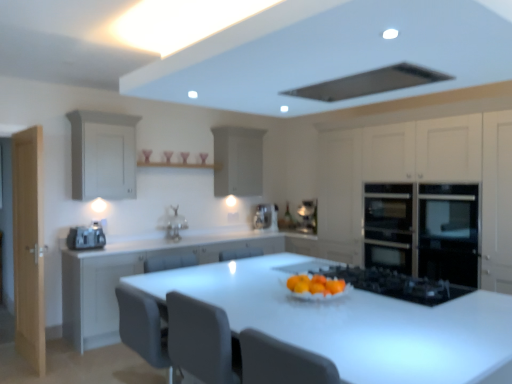
Question: Is black glass oven at right, the 1th cabinetry positioned from the right, not near matte silver sink at center?

Choices:
 (A) yes
 (B) no

Answer: (A)

Question: Considering the relative sizes of black glass oven at right, the 1th cabinetry positioned from the right, and matte silver sink at center in the image provided, is black glass oven at right, the 1th cabinetry positioned from the right, shorter than matte silver sink at center?

Choices:
 (A) no
 (B) yes

Answer: (A)

Question: Can you confirm if black glass oven at right, which ranks as the 4th cabinetry in left-to-right order, is bigger than matte silver sink at center?

Choices:
 (A) yes
 (B) no

Answer: (A)

Question: Is black glass oven at right, the 1th cabinetry positioned from the right, not within matte silver sink at center?

Choices:
 (A) yes
 (B) no

Answer: (A)

Question: From the image's perspective, is black glass oven at right, the 1th cabinetry positioned from the right, beneath matte silver sink at center?

Choices:
 (A) yes
 (B) no

Answer: (B)

Question: From the image's perspective, is black glass oven at right, which ranks as the 4th cabinetry in left-to-right order, on matte silver sink at center?

Choices:
 (A) yes
 (B) no

Answer: (A)

Question: From the image's perspective, is matte silver sink at center below white glossy table at center?

Choices:
 (A) no
 (B) yes

Answer: (A)

Question: Is the position of matte silver sink at center more distant than that of white glossy table at center?

Choices:
 (A) yes
 (B) no

Answer: (A)

Question: Is matte silver sink at center oriented away from white glossy table at center?

Choices:
 (A) yes
 (B) no

Answer: (B)

Question: Is matte silver sink at center smaller than white glossy table at center?

Choices:
 (A) yes
 (B) no

Answer: (A)

Question: From the image's perspective, is matte silver sink at center on white glossy table at center?

Choices:
 (A) no
 (B) yes

Answer: (B)

Question: Considering the relative sizes of matte silver sink at center and white glossy table at center in the image provided, is matte silver sink at center shorter than white glossy table at center?

Choices:
 (A) yes
 (B) no

Answer: (A)

Question: Could you tell me if matte white cabinet at left, arranged as the 4th cabinetry when viewed from the right, is turned towards light wood door at left?

Choices:
 (A) no
 (B) yes

Answer: (A)